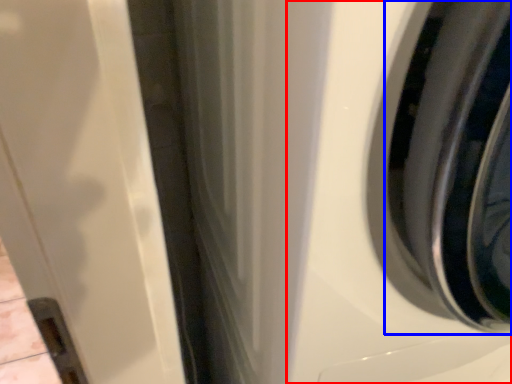
Question: Which object is closer to the camera taking this photo, washing machine (highlighted by a red box) or wheel (highlighted by a blue box)?

Choices:
 (A) washing machine
 (B) wheel

Answer: (A)